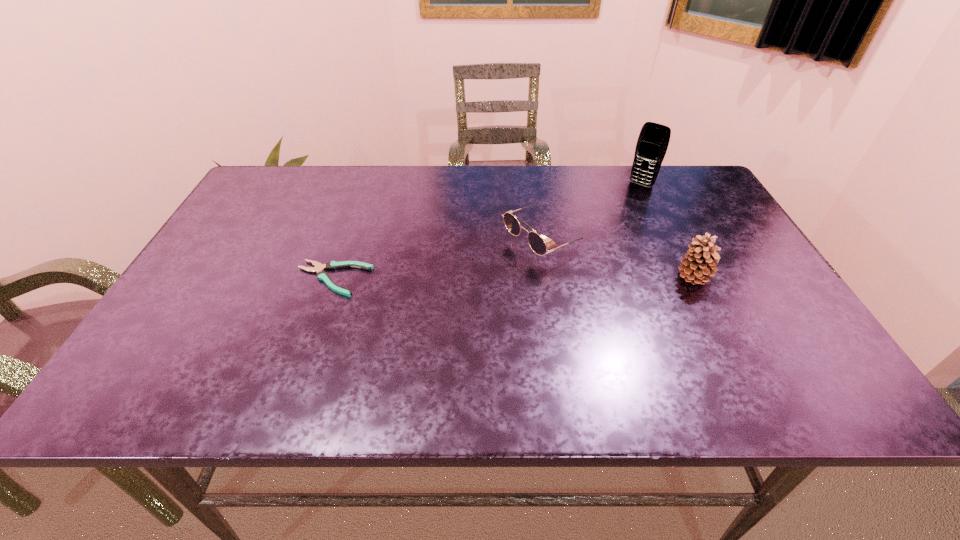
Where is `free space on the desktop that is between the leftmost object and the pinecone and is positioned on the front lenses of the sunglasses`? Image resolution: width=960 pixels, height=540 pixels. free space on the desktop that is between the leftmost object and the pinecone and is positioned on the front lenses of the sunglasses is located at coordinates (468, 278).

Identify the location of vacant space on the desktop that is between the pliers and the pinecone and is positioned on the screen of the farthest object. The width and height of the screenshot is (960, 540). (564, 278).